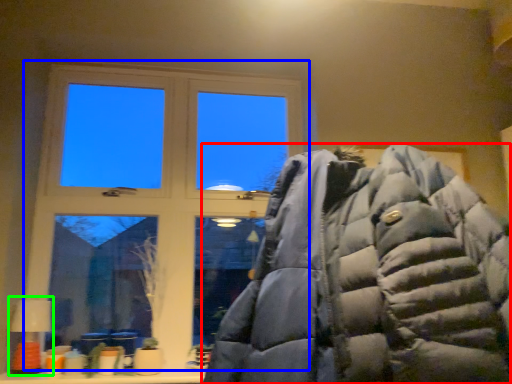
Question: Based on their relative distances, which object is nearer to jacket (highlighted by a red box)? Choose from window (highlighted by a blue box) and table lamp (highlighted by a green box).

Choices:
 (A) window
 (B) table lamp

Answer: (A)